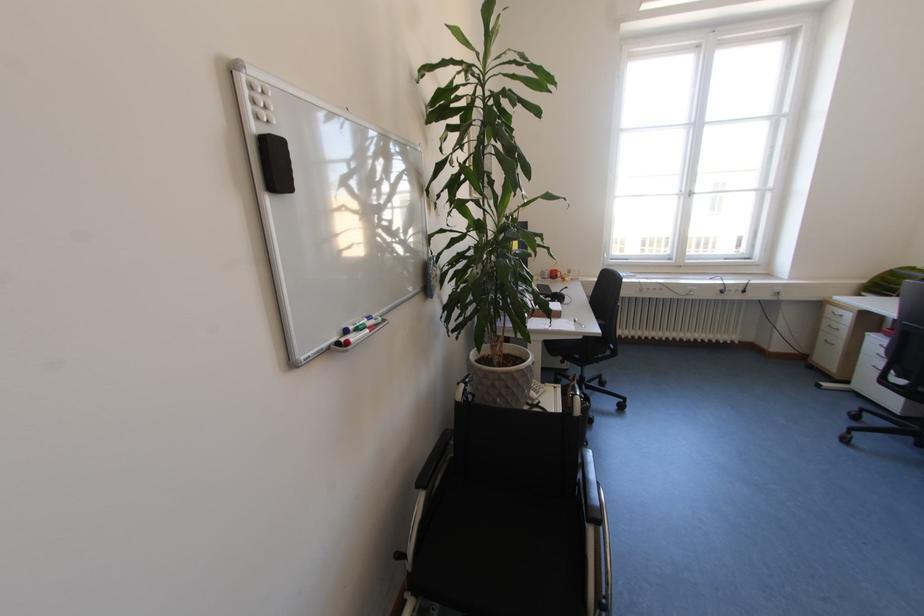
Describe the element at coordinates (503, 552) in the screenshot. I see `a wheelchair sitting surface` at that location.